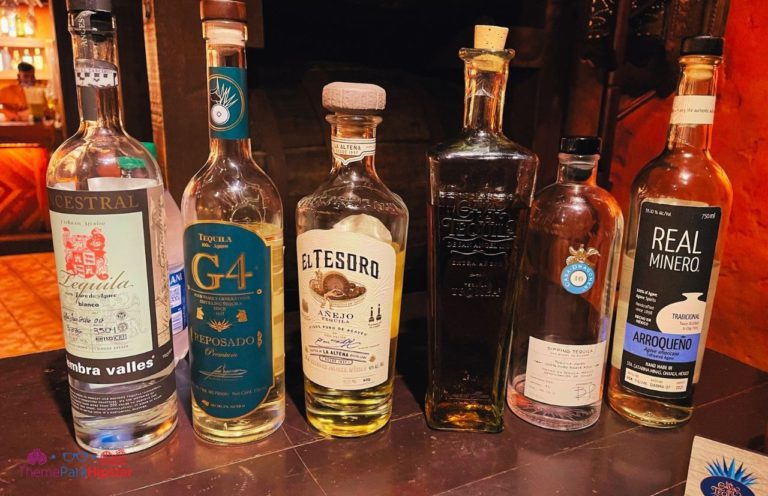
This screenshot has width=768, height=496. Identify the location of wall. (729, 338).